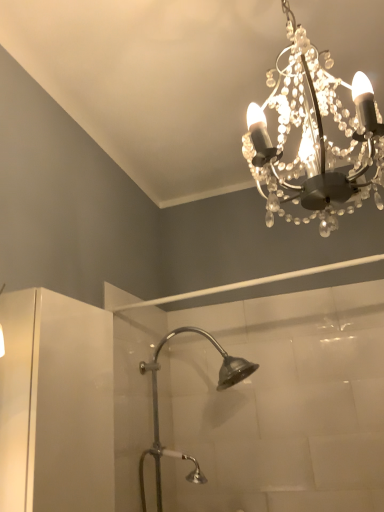
Question: Is point (148, 366) closer or farther from the camera than point (264, 163)?

Choices:
 (A) farther
 (B) closer

Answer: (A)

Question: In the image, is silver metallic shower head at center on the left side or the right side of clear crystal chandelier at upper center?

Choices:
 (A) right
 (B) left

Answer: (B)

Question: Considering the positions of silver metallic shower head at center and clear crystal chandelier at upper center in the image, is silver metallic shower head at center bigger or smaller than clear crystal chandelier at upper center?

Choices:
 (A) small
 (B) big

Answer: (B)

Question: From a real-world perspective, is clear crystal chandelier at upper center above or below silver metallic shower head at center?

Choices:
 (A) below
 (B) above

Answer: (B)

Question: Considering the positions of clear crystal chandelier at upper center and silver metallic shower head at center in the image, is clear crystal chandelier at upper center taller or shorter than silver metallic shower head at center?

Choices:
 (A) short
 (B) tall

Answer: (A)

Question: In terms of size, does clear crystal chandelier at upper center appear bigger or smaller than silver metallic shower head at center?

Choices:
 (A) big
 (B) small

Answer: (B)

Question: Is clear crystal chandelier at upper center inside the boundaries of silver metallic shower head at center, or outside?

Choices:
 (A) outside
 (B) inside

Answer: (A)